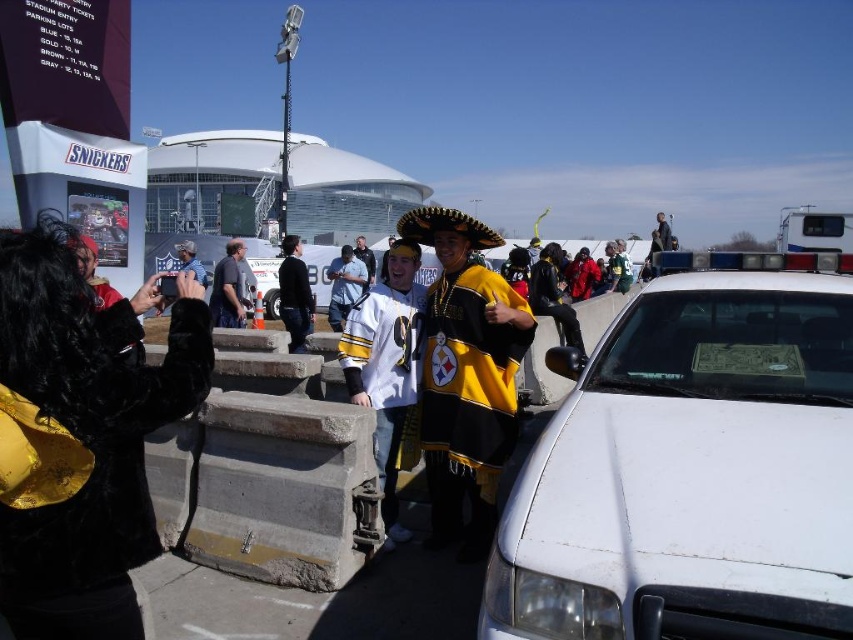
You are a photographer trying to capture a clear shot of the black leather jacket at center. However, the white matte police car at center is blocking your view. Based on the scene description, can you estimate whether the police car is wide enough to completely block the jacket from your camera angle?

The white matte police car at center might be wider than black leather jacket at center, so there is a possibility that the police car could block the jacket entirely depending on their exact positions and angles.

You are a spectator at the game and want to take a photo of the dark blue shirt at center without the white matte police car at center blocking the view. Is this possible based on their positions?

The white matte police car at center is located below the dark blue shirt at center, so it is possible to take a photo of the dark blue shirt at center without the police car blocking the view as long as the camera angle is adjusted to avoid the lower area where the car is positioned.